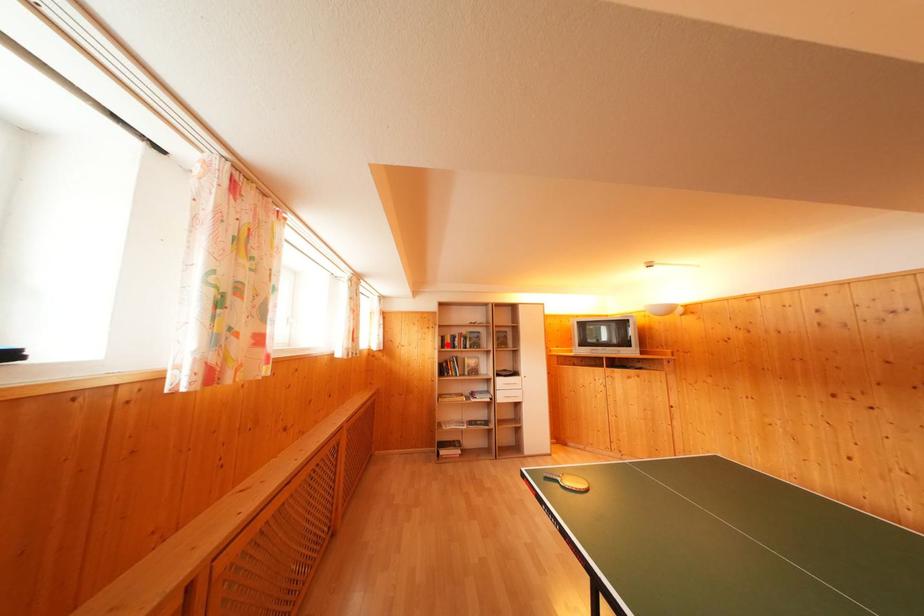
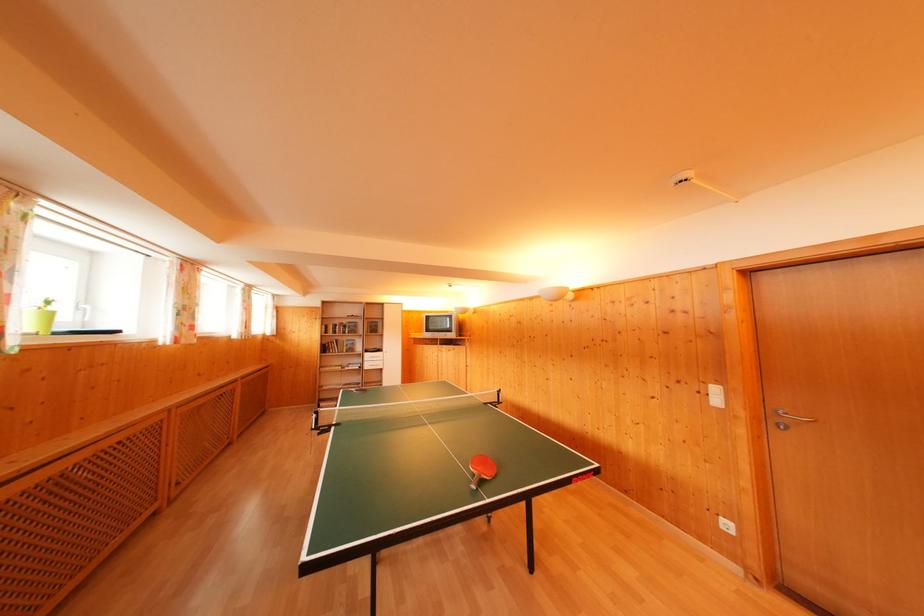
Where in the second image is the point corresponding to the highlighted location from the first image?

(331, 333)